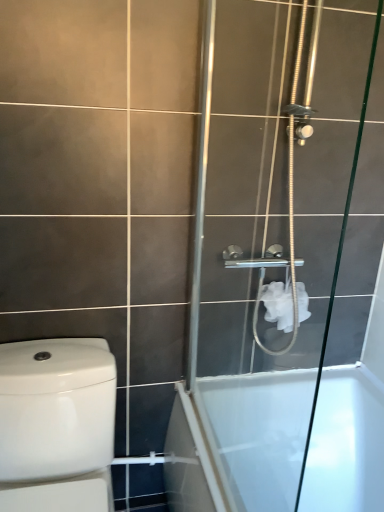
Question: Is point (291, 309) positioned closer to the camera than point (18, 397)?

Choices:
 (A) closer
 (B) farther

Answer: (B)

Question: Do you think white matte toilet paper at upper right is within white glossy toilet at left, or outside of it?

Choices:
 (A) inside
 (B) outside

Answer: (B)

Question: Based on their relative distances, which object is farther from the white glossy bathtub at lower right?

Choices:
 (A) white glossy toilet at left
 (B) white matte toilet paper at upper right
 (C) clear glass shower door at right

Answer: (A)

Question: Considering the real-world distances, which object is farthest from the white glossy bathtub at lower right?

Choices:
 (A) clear glass shower door at right
 (B) white matte toilet paper at upper right
 (C) white glossy toilet at left

Answer: (C)